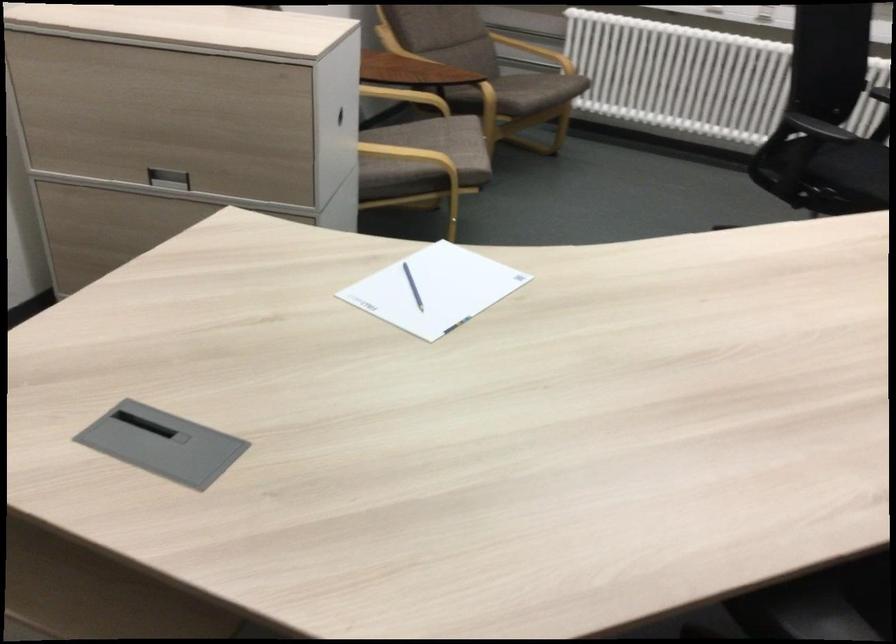
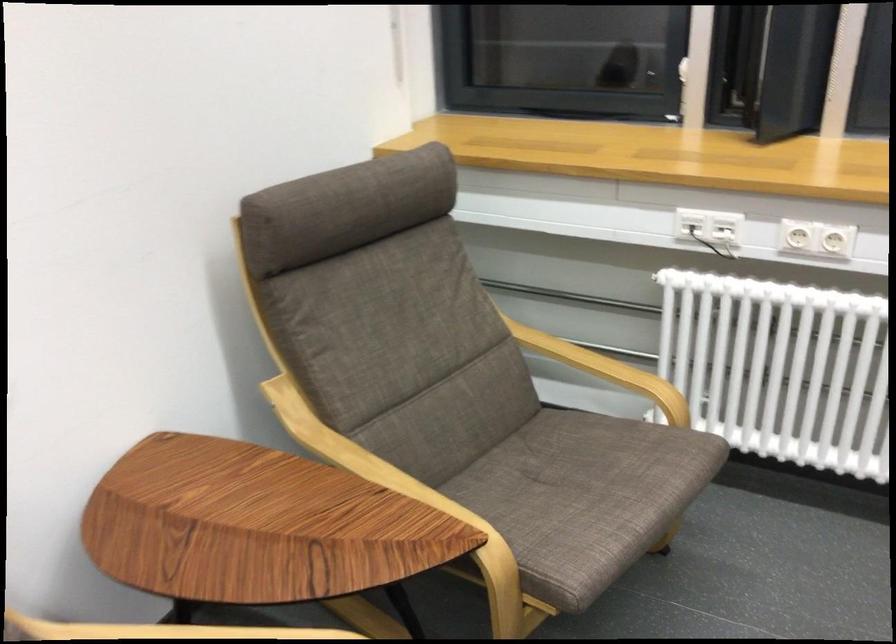
Question: What movement of the cameraman would produce the second image?

Choices:
 (A) Left
 (B) Right
 (C) Forward
 (D) Backward

Answer: (C)